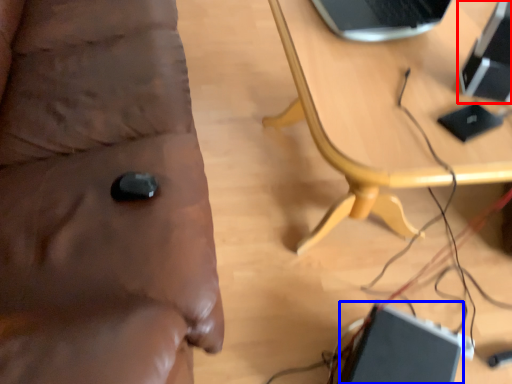
Question: Which of the following is the farthest to the observer, computer (highlighted by a red box) or laptop (highlighted by a blue box)?

Choices:
 (A) computer
 (B) laptop

Answer: (B)